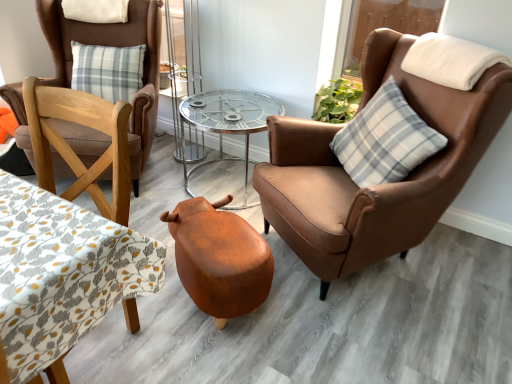
Where is `brown leather chair at left, acting as the first chair starting from the left`? The width and height of the screenshot is (512, 384). brown leather chair at left, acting as the first chair starting from the left is located at coordinates (116, 46).

Locate an element on the screen. This screenshot has height=384, width=512. clear glass table at center is located at coordinates (227, 123).

The width and height of the screenshot is (512, 384). Describe the element at coordinates (227, 123) in the screenshot. I see `clear glass table at center` at that location.

Describe the element at coordinates (62, 273) in the screenshot. I see `patterned fabric table at left` at that location.

Image resolution: width=512 pixels, height=384 pixels. I want to click on leather-like stool at center, so click(219, 258).

Who is shorter, clear glass table at center or brown leather chair at left, which is counted as the second chair, starting from the right?

With less height is clear glass table at center.

Considering the positions of objects clear glass table at center and brown leather chair at left, which is counted as the second chair, starting from the right, in the image provided, who is more to the right, clear glass table at center or brown leather chair at left, which is counted as the second chair, starting from the right,?

Positioned to the right is clear glass table at center.

Is point (254, 120) positioned after point (16, 97)?

That is True.

From the image's perspective, is clear glass table at center located above or below brown leather chair at left, which is counted as the second chair, starting from the right?

Based on their image positions, clear glass table at center is located beneath brown leather chair at left, which is counted as the second chair, starting from the right.

Considering the relative positions of brown leather chair at right, positioned as the 1th chair in right-to-left order, and white soft pillow at upper left, the 1th pillow viewed from the top, in the image provided, is brown leather chair at right, positioned as the 1th chair in right-to-left order, to the left or to the right of white soft pillow at upper left, the 1th pillow viewed from the top,?

Clearly, brown leather chair at right, positioned as the 1th chair in right-to-left order, is on the right of white soft pillow at upper left, the 1th pillow viewed from the top, in the image.

From the image's perspective, is brown leather chair at right, positioned as the 1th chair in right-to-left order, located beneath white soft pillow at upper left, the 1th pillow viewed from the left?

Yes, from the image's perspective, brown leather chair at right, positioned as the 1th chair in right-to-left order, is beneath white soft pillow at upper left, the 1th pillow viewed from the left.

Is brown leather chair at right, arranged as the 2th chair when viewed from the left, turned away from white soft pillow at upper left, the 1th pillow viewed from the left?

No, brown leather chair at right, arranged as the 2th chair when viewed from the left, is not facing the opposite direction of white soft pillow at upper left, the 1th pillow viewed from the left.

Could white soft pillow at upper left, acting as the 3th pillow starting from the bottom, be considered to be inside brown leather chair at right, arranged as the 2th chair when viewed from the left?

No, brown leather chair at right, arranged as the 2th chair when viewed from the left, does not contain white soft pillow at upper left, acting as the 3th pillow starting from the bottom.

Is patterned fabric table at left to the left or to the right of brown leather chair at right, positioned as the 1th chair in right-to-left order, in the image?

patterned fabric table at left is to the left of brown leather chair at right, positioned as the 1th chair in right-to-left order.

Can you confirm if patterned fabric table at left is shorter than brown leather chair at right, arranged as the 2th chair when viewed from the left?

Yes, patterned fabric table at left is shorter than brown leather chair at right, arranged as the 2th chair when viewed from the left.

From a real-world perspective, is patterned fabric table at left positioned above or below brown leather chair at right, arranged as the 2th chair when viewed from the left?

patterned fabric table at left is situated lower than brown leather chair at right, arranged as the 2th chair when viewed from the left, in the real world.

Is white soft pillow at upper left, the 3th pillow in the right-to-left sequence, aimed at white fleece pillow at upper right, which is the second pillow from bottom to top?

No.

Where is `pillow that is the 1st object directly below the white fleece pillow at upper right, the third pillow when ordered from left to right (from a real-world perspective)`? pillow that is the 1st object directly below the white fleece pillow at upper right, the third pillow when ordered from left to right (from a real-world perspective) is located at coordinates (96, 11).

Is white soft pillow at upper left, the 1th pillow viewed from the top, in front of or behind white fleece pillow at upper right, the third pillow when ordered from left to right, in the image?

white soft pillow at upper left, the 1th pillow viewed from the top, is positioned farther from the viewer than white fleece pillow at upper right, the third pillow when ordered from left to right.

Locate an element on the screen. This screenshot has height=384, width=512. coffee table below the brown leather chair at right, arranged as the 2th chair when viewed from the left (from a real-world perspective) is located at coordinates (62, 273).

From a real-world perspective, is brown leather chair at right, arranged as the 2th chair when viewed from the left, above or below patterned fabric table at left?

Clearly, from a real-world perspective, brown leather chair at right, arranged as the 2th chair when viewed from the left, is above patterned fabric table at left.

In the image, is brown leather chair at left, acting as the first chair starting from the left, positioned in front of or behind white fleece pillow at upper right, the first pillow viewed from the right?

Visually, brown leather chair at left, acting as the first chair starting from the left, is located behind white fleece pillow at upper right, the first pillow viewed from the right.

Are brown leather chair at left, acting as the first chair starting from the left, and white fleece pillow at upper right, which is the second pillow from bottom to top, far apart?

Yes, brown leather chair at left, acting as the first chair starting from the left, is far from white fleece pillow at upper right, which is the second pillow from bottom to top.

From a real-world perspective, which object stands above the other?

white fleece pillow at upper right, which is the second pillow from bottom to top.

Is white fleece pillow at upper right, the first pillow viewed from the right, inside brown leather chair at left, acting as the first chair starting from the left?

Actually, white fleece pillow at upper right, the first pillow viewed from the right, is outside brown leather chair at left, acting as the first chair starting from the left.

Based on the photo, between patterned fabric table at left and white plaid pillow at upper right, which is counted as the 3th pillow, starting from the top, which one appears on the right side from the viewer's perspective?

Positioned to the right is white plaid pillow at upper right, which is counted as the 3th pillow, starting from the top.

Where is `coffee table below the white plaid pillow at upper right, which is counted as the 3th pillow, starting from the top (from the image's perspective)`? coffee table below the white plaid pillow at upper right, which is counted as the 3th pillow, starting from the top (from the image's perspective) is located at coordinates (62, 273).

Is patterned fabric table at left further to camera compared to white plaid pillow at upper right, which appears as the second pillow when viewed from the left?

No, the depth of patterned fabric table at left is less than that of white plaid pillow at upper right, which appears as the second pillow when viewed from the left.

Consider the image. Is patterned fabric table at left not close to white plaid pillow at upper right, the second pillow in the right-to-left sequence?

Yes, patterned fabric table at left and white plaid pillow at upper right, the second pillow in the right-to-left sequence, are located far from each other.

Identify the location of table on the right of brown leather chair at left, acting as the first chair starting from the left. The width and height of the screenshot is (512, 384). (227, 123).

From the image's perspective, which chair is the 2nd one below the white soft pillow at upper left, the 1th pillow viewed from the top? Please provide its 2D coordinates.

[(379, 185)]

When comparing their distances from leather-like stool at center, does patterned fabric table at left or white plaid pillow at upper right, which appears as the second pillow when viewed from the left, seem closer?

The object closer to leather-like stool at center is patterned fabric table at left.

Looking at the image, which one is located further to patterned fabric table at left, leather-like stool at center or white plaid pillow at upper right, which ranks as the first pillow in bottom-to-top order?

white plaid pillow at upper right, which ranks as the first pillow in bottom-to-top order, is further to patterned fabric table at left.

From the image, which object appears to be farther from white plaid pillow at upper right, which appears as the second pillow when viewed from the left, white fleece pillow at upper right, the third pillow when ordered from left to right, or clear glass table at center?

Among the two, clear glass table at center is located further to white plaid pillow at upper right, which appears as the second pillow when viewed from the left.

Which object lies nearer to the anchor point patterned fabric table at left, brown leather chair at left, which is counted as the second chair, starting from the right, or white fleece pillow at upper right, which is the second pillow from bottom to top?

Among the two, brown leather chair at left, which is counted as the second chair, starting from the right, is located nearer to patterned fabric table at left.

When comparing their distances from white plaid pillow at upper right, the second pillow in the right-to-left sequence, does brown leather chair at right, arranged as the 2th chair when viewed from the left, or leather-like stool at center seem further?

Among the two, leather-like stool at center is located further to white plaid pillow at upper right, the second pillow in the right-to-left sequence.

From the image, which object appears to be farther from white soft pillow at upper left, acting as the 3th pillow starting from the bottom, patterned fabric table at left or white plaid pillow at upper right, the second pillow in the right-to-left sequence?

patterned fabric table at left.

Which object lies nearer to the anchor point patterned fabric table at left, leather-like stool at center or white soft pillow at upper left, the 1th pillow viewed from the top?

leather-like stool at center is closer to patterned fabric table at left.

Based on their spatial positions, is leather-like stool at center or brown leather chair at right, positioned as the 1th chair in right-to-left order, closer to white fleece pillow at upper right, the second pillow viewed from the top?

brown leather chair at right, positioned as the 1th chair in right-to-left order.

The width and height of the screenshot is (512, 384). In order to click on chair situated between brown leather chair at left, acting as the first chair starting from the left, and white plaid pillow at upper right, which ranks as the first pillow in bottom-to-top order, from left to right in this screenshot , I will do `click(379, 185)`.

I want to click on table between brown leather chair at left, acting as the first chair starting from the left, and white fleece pillow at upper right, the first pillow viewed from the right, in the horizontal direction, so click(x=227, y=123).

Identify the location of table located between leather-like stool at center and white fleece pillow at upper right, the first pillow viewed from the right, in the left-right direction. (227, 123).

Locate an element on the screen. pillow located between brown leather chair at left, which is counted as the second chair, starting from the right, and white fleece pillow at upper right, the first pillow viewed from the right, in the left-right direction is located at coordinates (385, 139).